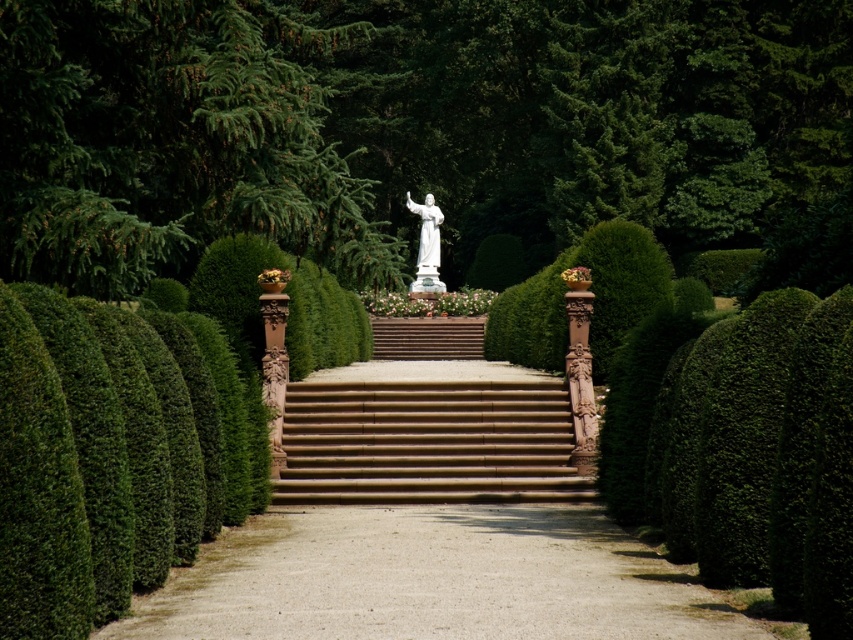
Question: Which point is farther to the camera?

Choices:
 (A) (418, 442)
 (B) (212, 64)

Answer: (A)

Question: Is green leafy bush at center wider than green leafy hedge at left?

Choices:
 (A) yes
 (B) no

Answer: (A)

Question: Does dirt/gravel path at center appear on the left side of green leafy hedge at left?

Choices:
 (A) yes
 (B) no

Answer: (B)

Question: Does green leafy bush at upper center appear on the right side of green leafy hedge at left?

Choices:
 (A) yes
 (B) no

Answer: (A)

Question: Which object is closer to the camera taking this photo?

Choices:
 (A) brown stone stairs at center
 (B) green leafy hedge at left
 (C) white marble statue at center
 (D) dirt/gravel path at center

Answer: (B)

Question: Which object is closer to the camera taking this photo?

Choices:
 (A) green leafy hedge at left
 (B) green leafy bush at upper center
 (C) dirt/gravel path at center
 (D) brown stone stairs at center

Answer: (A)